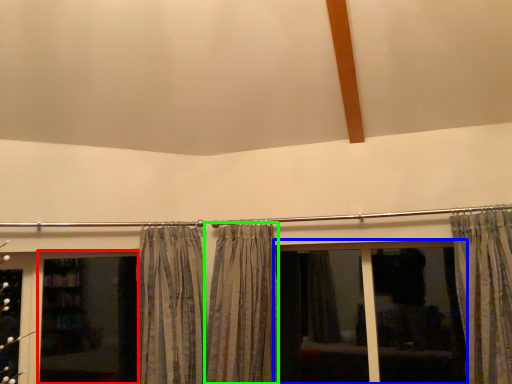
Question: Based on their relative distances, which object is farther from screen door (highlighted by a red box)? Choose from bay window (highlighted by a blue box) and curtain (highlighted by a green box).

Choices:
 (A) bay window
 (B) curtain

Answer: (A)